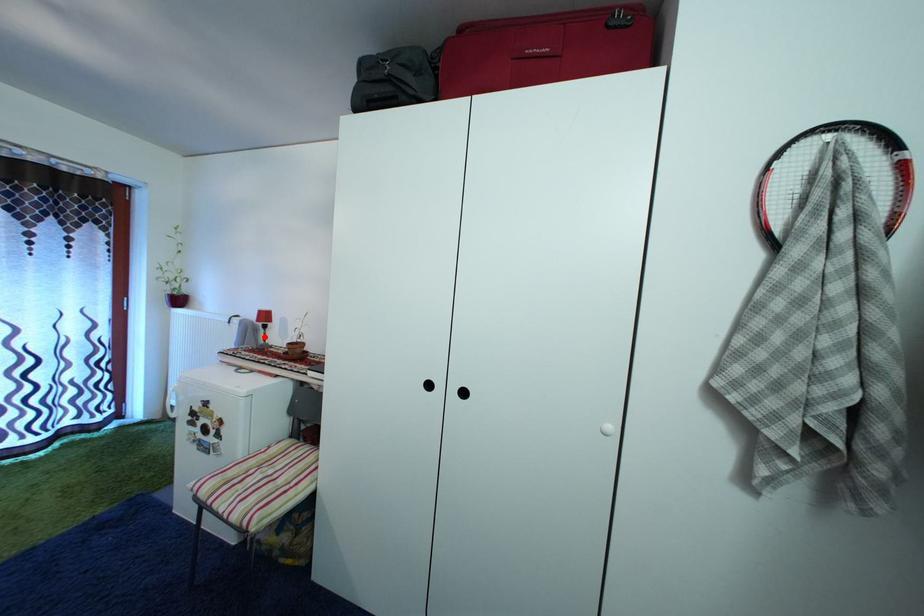
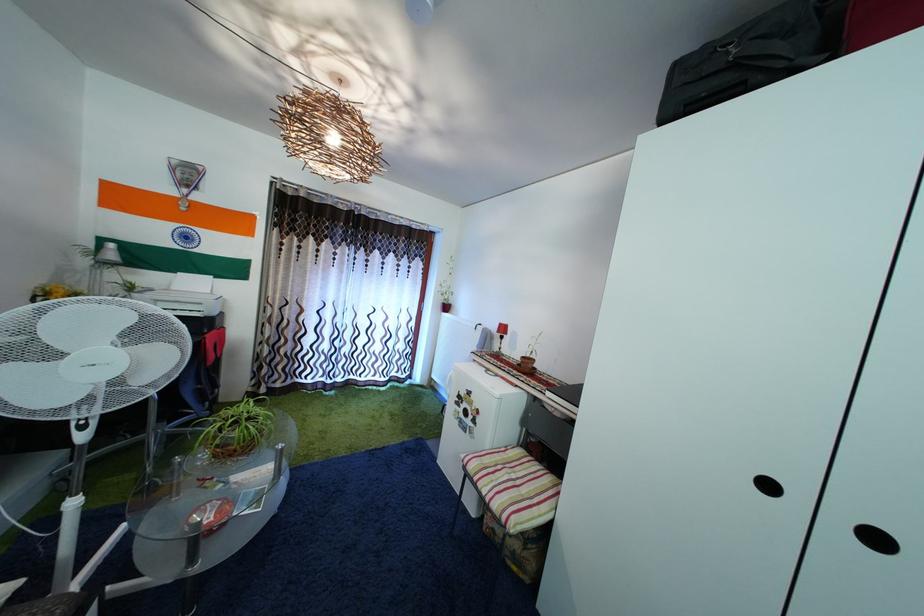
Find the pixel in the second image that matches the highlighted location in the first image.

(500, 345)